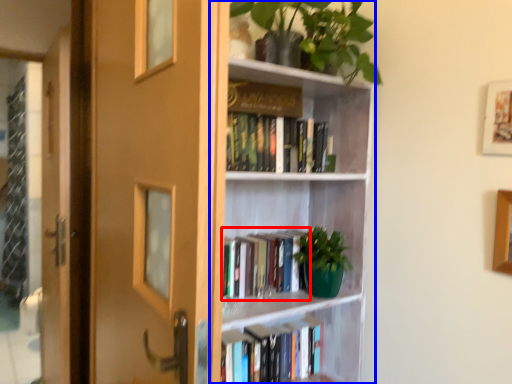
Question: Which point is closer to the camera, book (highlighted by a red box) or bookcase (highlighted by a blue box)?

Choices:
 (A) book
 (B) bookcase

Answer: (B)